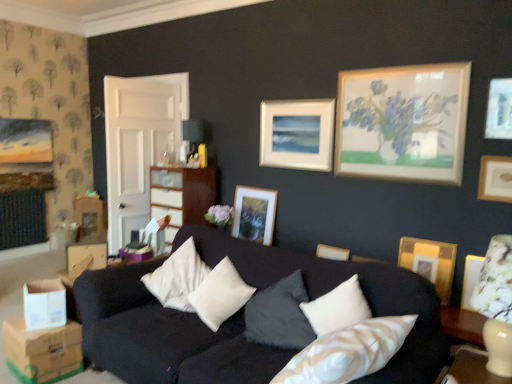
Question: From a real-world perspective, does matte gold picture frame at center, marked as the 4th picture frame in a right-to-left arrangement, sit lower than wooden picture frame at upper right, acting as the 4th picture frame starting from the back?

Choices:
 (A) no
 (B) yes

Answer: (B)

Question: Considering the relative sizes of matte gold picture frame at center, marked as the 4th picture frame in a right-to-left arrangement, and wooden picture frame at upper right, marked as the first picture frame in a front-to-back arrangement, in the image provided, is matte gold picture frame at center, marked as the 4th picture frame in a right-to-left arrangement, thinner than wooden picture frame at upper right, marked as the first picture frame in a front-to-back arrangement,?

Choices:
 (A) no
 (B) yes

Answer: (A)

Question: Can you confirm if matte gold picture frame at center, which is the first picture frame from back to front, is bigger than wooden picture frame at upper right, acting as the 4th picture frame starting from the back?

Choices:
 (A) yes
 (B) no

Answer: (A)

Question: Does matte gold picture frame at center, which is the 1th picture frame from left to right, appear on the left side of wooden picture frame at upper right, the fourth picture frame positioned from the left?

Choices:
 (A) yes
 (B) no

Answer: (A)

Question: Can you confirm if matte gold picture frame at center, which is the 1th picture frame from left to right, is taller than wooden picture frame at upper right, marked as the first picture frame in a front-to-back arrangement?

Choices:
 (A) yes
 (B) no

Answer: (A)

Question: Looking at the image, does white soft cushion at center seem bigger or smaller compared to matte gold picture frame at center, marked as the 4th picture frame in a right-to-left arrangement?

Choices:
 (A) big
 (B) small

Answer: (A)

Question: Is white soft cushion at center situated inside matte gold picture frame at center, marked as the 4th picture frame in a front-to-back arrangement, or outside?

Choices:
 (A) outside
 (B) inside

Answer: (A)

Question: Considering the positions of white soft cushion at center and matte gold picture frame at center, marked as the 4th picture frame in a front-to-back arrangement, in the image, is white soft cushion at center taller or shorter than matte gold picture frame at center, marked as the 4th picture frame in a front-to-back arrangement,?

Choices:
 (A) tall
 (B) short

Answer: (B)

Question: From the image's perspective, is white soft cushion at center located above or below matte gold picture frame at center, which is the 1th picture frame from left to right?

Choices:
 (A) above
 (B) below

Answer: (B)

Question: Considering the positions of point coord(224,263) and point coord(433,251), is point coord(224,263) closer or farther from the camera than point coord(433,251)?

Choices:
 (A) closer
 (B) farther

Answer: (A)

Question: Is white soft cushion at center taller or shorter than gold textured picture frame at right, which is the 2th picture frame in right-to-left order?

Choices:
 (A) short
 (B) tall

Answer: (B)

Question: Looking at the image, does white soft cushion at center seem bigger or smaller compared to gold textured picture frame at right, arranged as the 3th picture frame when viewed from the back?

Choices:
 (A) small
 (B) big

Answer: (B)

Question: Looking at their shapes, would you say white soft cushion at center is wider or thinner than gold textured picture frame at right, the third picture frame positioned from the left?

Choices:
 (A) wide
 (B) thin

Answer: (A)

Question: Considering the positions of matte cream dresser at center and gold textured picture frame at right, which is the 2th picture frame in right-to-left order, in the image, is matte cream dresser at center taller or shorter than gold textured picture frame at right, which is the 2th picture frame in right-to-left order,?

Choices:
 (A) short
 (B) tall

Answer: (B)

Question: Based on their positions, is matte cream dresser at center located to the left or right of gold textured picture frame at right, which is the 2th picture frame in right-to-left order?

Choices:
 (A) right
 (B) left

Answer: (B)